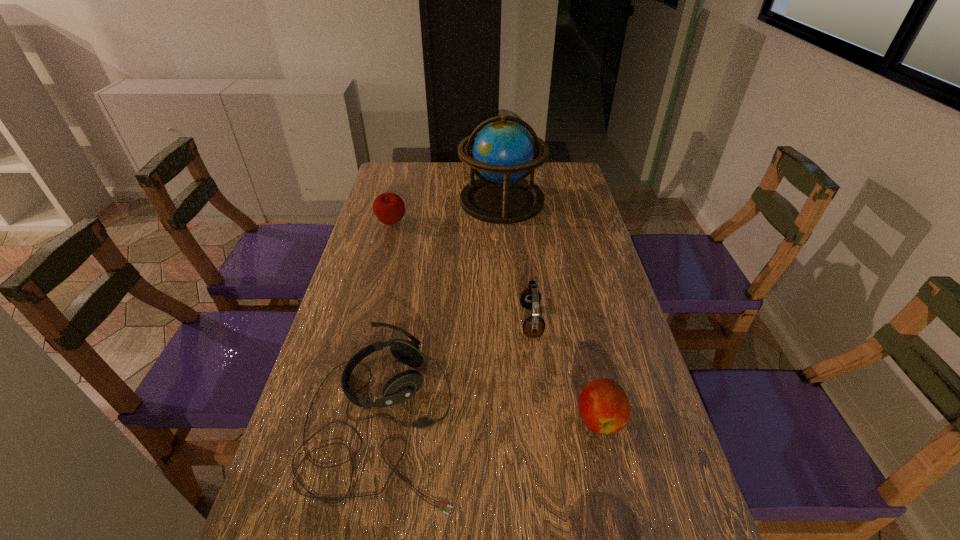
This screenshot has height=540, width=960. Identify the location of vacant space situated on the ear cups of the right headset. (502, 321).

What are the coordinates of `free region located on the back of the farther apple` in the screenshot? It's located at (400, 191).

At what (x,y) coordinates should I click in order to perform the action: click on vacant space located on the left of the nearer apple. Please return your answer as a coordinate pair (x, y). The width and height of the screenshot is (960, 540). Looking at the image, I should click on (448, 418).

I want to click on free space located on the outer surface of the left headset, so click(x=489, y=418).

Find the location of `object present at the far edge`. object present at the far edge is located at coordinates (503, 153).

Locate an element on the screen. apple that is at the left edge is located at coordinates (389, 208).

The width and height of the screenshot is (960, 540). What are the coordinates of `headset located in the left edge section of the desktop` in the screenshot? It's located at (402, 386).

I want to click on globe at the right edge, so click(x=503, y=153).

I want to click on apple present at the right edge, so click(x=604, y=407).

Identify the location of object located in the far right corner section of the desktop. The image size is (960, 540). [503, 153].